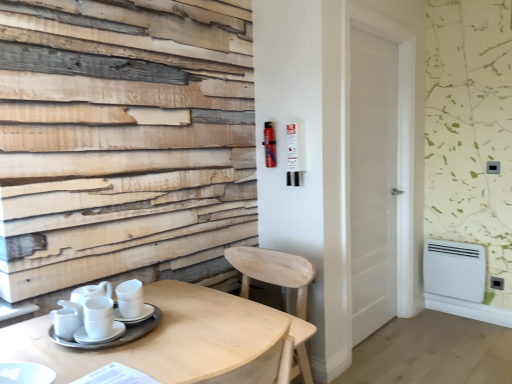
Question: Visually, is light wood table at lower left positioned to the left or to the right of light wood chair at lower center?

Choices:
 (A) right
 (B) left

Answer: (B)

Question: Considering the positions of point (94, 365) and point (302, 301), is point (94, 365) closer or farther from the camera than point (302, 301)?

Choices:
 (A) farther
 (B) closer

Answer: (B)

Question: Considering the real-world distances, which object is closest to the light wood chair at lower center?

Choices:
 (A) white ceramic saucer at table
 (B) light wood table at lower left
 (C) white glossy cups at lower left
 (D) metallic red extinguisher at upper right
 (E) white glossy cup at center

Answer: (B)

Question: Estimate the real-world distances between objects in this image. Which object is farther from the white glossy cups at lower left?

Choices:
 (A) white plastic radiator at lower right
 (B) metallic red extinguisher at upper right
 (C) light wood chair at lower center
 (D) white glossy cup at center
 (E) white wooden door at center

Answer: (A)